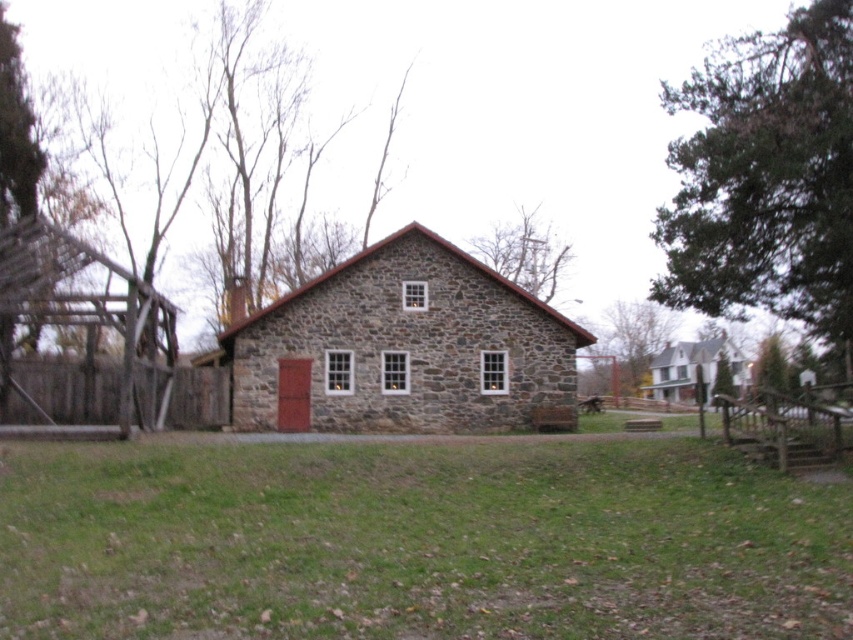
Is green grass at center shorter than brown wooden fence at left?

In fact, green grass at center may be taller than brown wooden fence at left.

Between green grass at center and brown wooden fence at left, which one is positioned lower?

Positioned lower is green grass at center.

This screenshot has height=640, width=853. In order to click on green grass at center in this screenshot , I will do `click(418, 541)`.

Does brown wooden fence at left appear on the right side of white stone barn at center?

In fact, brown wooden fence at left is to the left of white stone barn at center.

Describe the element at coordinates (71, 388) in the screenshot. I see `brown wooden fence at left` at that location.

You are a GUI agent. You are given a task and a screenshot of the screen. Output one action in this format:
    pyautogui.click(x=<x>, y=<y>)
    Task: Click on the brown wooden fence at left
    Image resolution: width=853 pixels, height=640 pixels.
    Given the screenshot: What is the action you would take?
    pyautogui.click(x=71, y=388)

Does stone barn at center appear under brown wooden fence at left?

No.

Does point (250, 387) lie behind point (218, 412)?

No.

Who is more forward, (428, 301) or (180, 428)?

Point (180, 428) is more forward.

Find the location of a particular element. The width and height of the screenshot is (853, 640). stone barn at center is located at coordinates (405, 348).